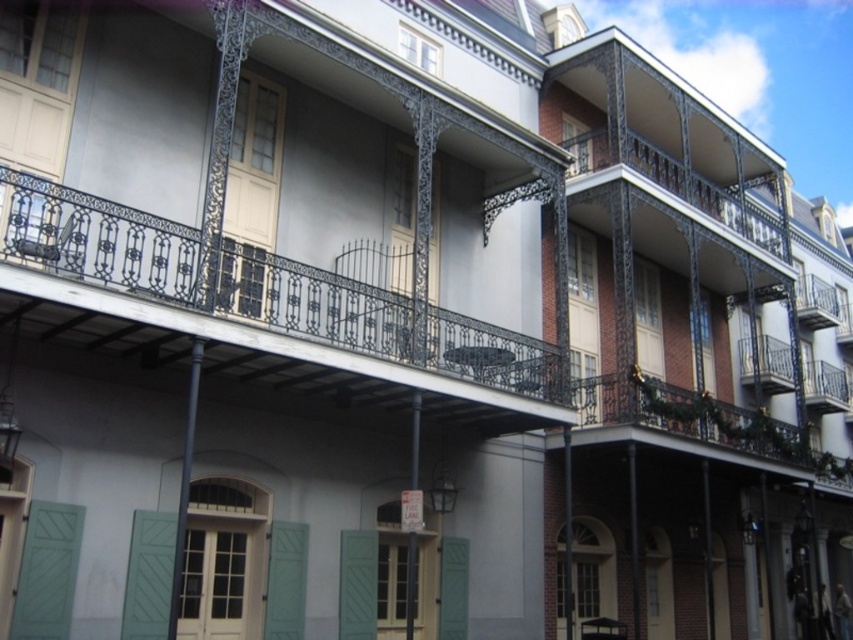
You are standing in front of the building and want to determine the relative positions of two points marked on the facade. Which point, point (22, 214) or point (254, 212), is closer to you?

Point (22, 214) is closer to the viewer than point (254, 212).

You are standing in front of the building and want to reach both the black wrought iron balcony at center and the green matte shutter at center. Which one is closer to you?

The black wrought iron balcony at center is 5.83 meters away from the green matte shutter at center, so the distance between them is 5.83 meters. However, since you are standing in front of the building, it is unclear which one is closer without knowing your exact position relative to both objects. Please provide more information about your location.